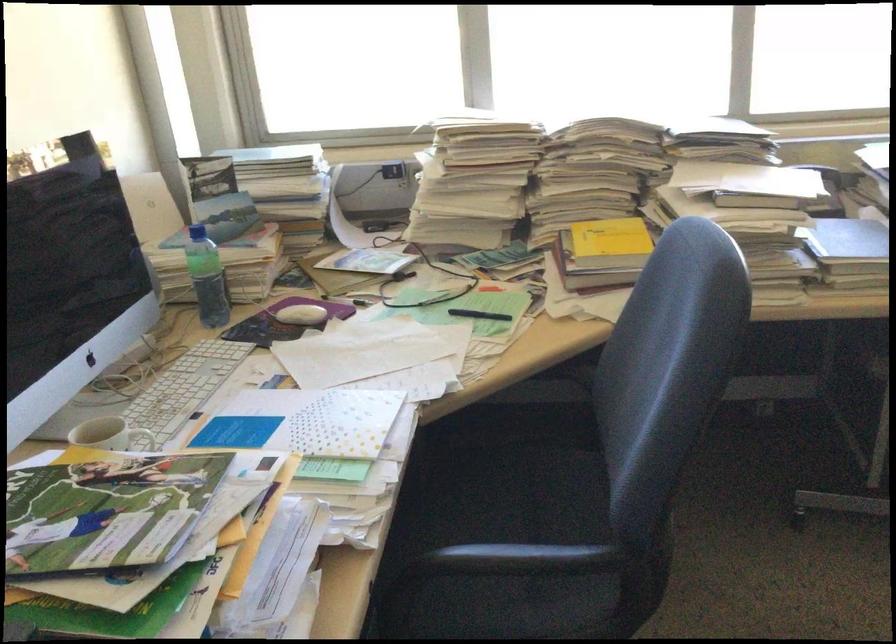
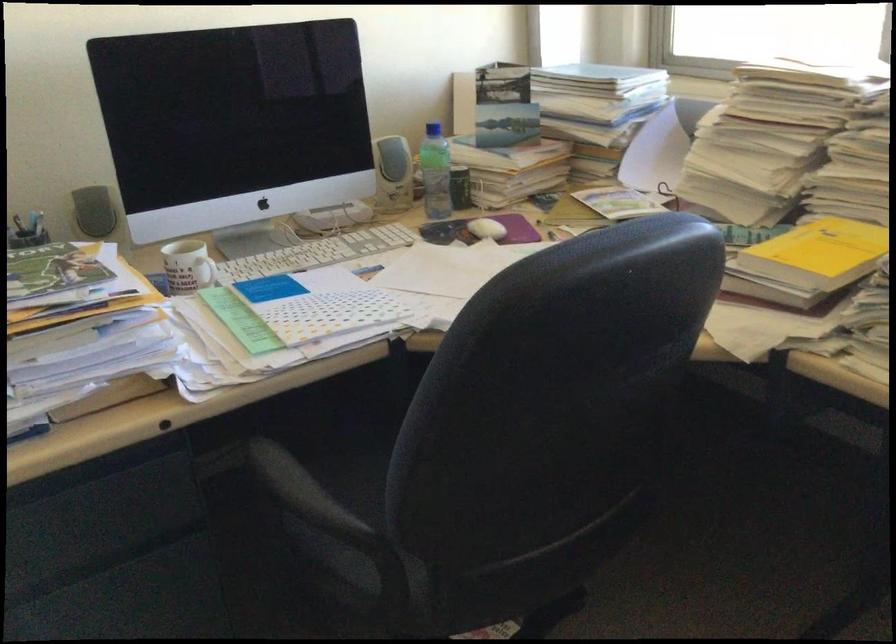
Where in the second image is the point corresponding to point 158,295 from the first image?

(392, 174)